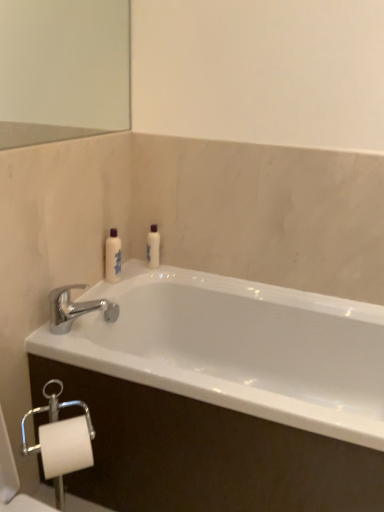
Where is `vacant space to the right of white glossy lotion at center, positioned as the 2th toiletry in left-to-right order`? The image size is (384, 512). vacant space to the right of white glossy lotion at center, positioned as the 2th toiletry in left-to-right order is located at coordinates (183, 267).